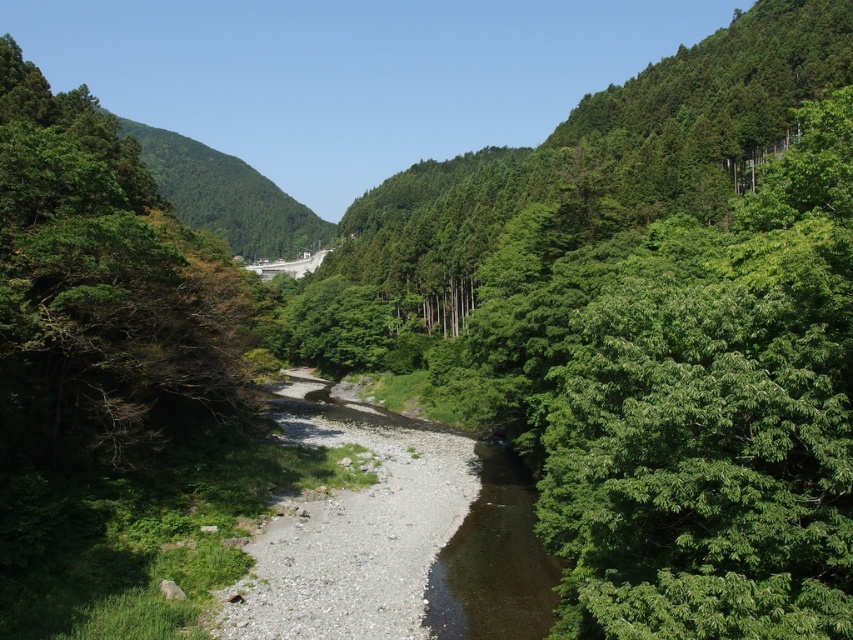
In the scene shown: Between green leafy tree at center and green leafy tree at left, which one is positioned lower?

green leafy tree at left is lower down.

Who is taller, green leafy tree at center or green leafy tree at left?

green leafy tree at center is taller.

Is point (758, 70) more distant than point (73, 365)?

Yes, point (758, 70) is farther from viewer.

You are a GUI agent. You are given a task and a screenshot of the screen. Output one action in this format:
    pyautogui.click(x=<x>, y=<y>)
    Task: Click on the green leafy tree at center
    This screenshot has height=640, width=853.
    Given the screenshot: What is the action you would take?
    pyautogui.click(x=654, y=328)

Is green leafy tree at left bigger than green forested hillside at center?

No, green leafy tree at left is not bigger than green forested hillside at center.

Does green leafy tree at left have a smaller size compared to green forested hillside at center?

Indeed, green leafy tree at left has a smaller size compared to green forested hillside at center.

Who is more distant from viewer, [32,84] or [177,170]?

The point [177,170] is more distant.

The height and width of the screenshot is (640, 853). What are the coordinates of `green leafy tree at left` in the screenshot? It's located at (102, 289).

Which of these two, green leafy tree at center or green forested hillside at center, stands shorter?

Standing shorter between the two is green leafy tree at center.

Does green leafy tree at center have a lesser width compared to green forested hillside at center?

Yes, green leafy tree at center is thinner than green forested hillside at center.

Between point (784, 612) and point (194, 172), which one is positioned in front?

Point (784, 612) is in front.

Locate an element on the screen. This screenshot has width=853, height=640. green leafy tree at center is located at coordinates (654, 328).